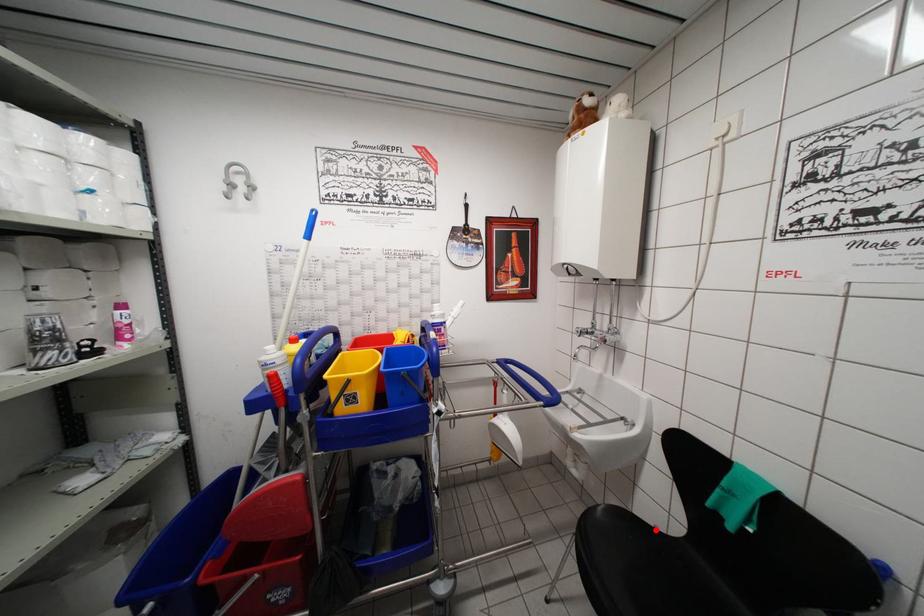
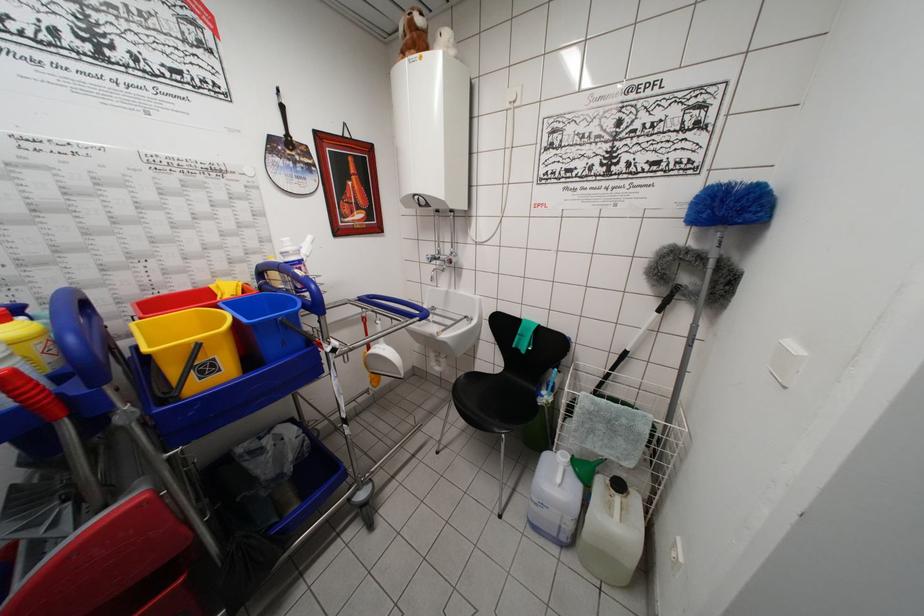
Locate, in the second image, the point that corresponds to the highlighted location in the first image.

(491, 379)